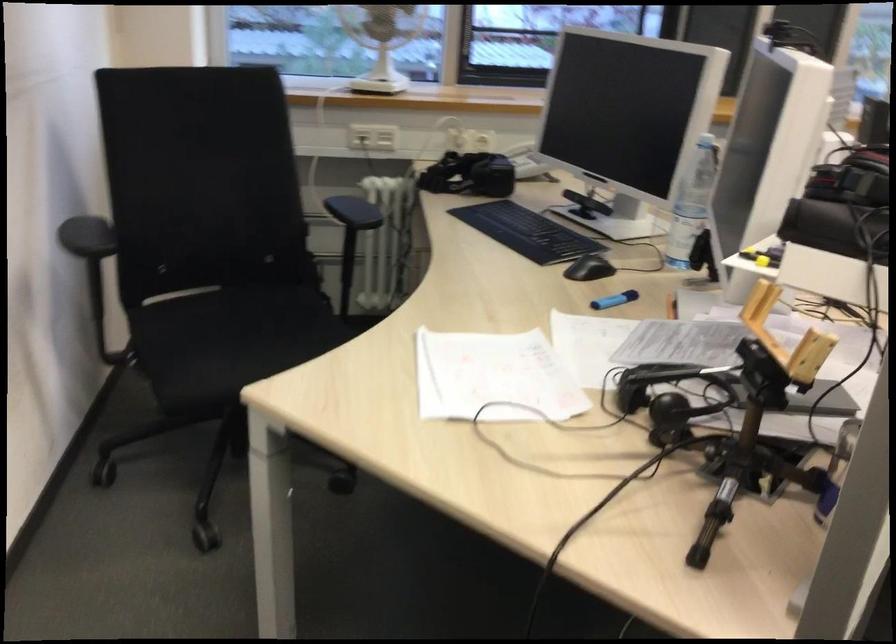
I want to click on black chair sitting surface, so click(x=228, y=339).